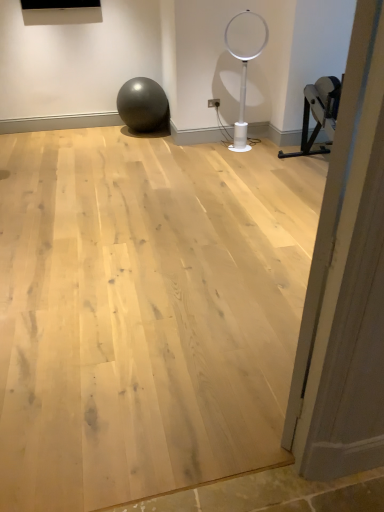
Question: From the image's perspective, is white plastic basketball hoop at center under natural wood floor at center?

Choices:
 (A) yes
 (B) no

Answer: (B)

Question: From the image's perspective, is white plastic basketball hoop at center above natural wood floor at center?

Choices:
 (A) no
 (B) yes

Answer: (B)

Question: Does white plastic basketball hoop at center have a lesser height compared to natural wood floor at center?

Choices:
 (A) yes
 (B) no

Answer: (B)

Question: Is natural wood floor at center surrounded by white plastic basketball hoop at center?

Choices:
 (A) no
 (B) yes

Answer: (A)

Question: Can you confirm if white plastic basketball hoop at center is wider than natural wood floor at center?

Choices:
 (A) yes
 (B) no

Answer: (B)

Question: From a real-world perspective, is white plastic basketball hoop at center above or below natural wood floor at center?

Choices:
 (A) above
 (B) below

Answer: (A)

Question: Is white plastic basketball hoop at center inside or outside of natural wood floor at center?

Choices:
 (A) outside
 (B) inside

Answer: (A)

Question: Is white plastic basketball hoop at center to the left or to the right of natural wood floor at center in the image?

Choices:
 (A) right
 (B) left

Answer: (A)

Question: In the image, is white plastic basketball hoop at center positioned in front of or behind natural wood floor at center?

Choices:
 (A) front
 (B) behind

Answer: (B)

Question: Is natural wood floor at center spatially inside white plastic basketball hoop at center, or outside of it?

Choices:
 (A) outside
 (B) inside

Answer: (A)

Question: Visually, is natural wood floor at center positioned to the left or to the right of white plastic basketball hoop at center?

Choices:
 (A) right
 (B) left

Answer: (B)

Question: From the image's perspective, relative to white plastic basketball hoop at center, is natural wood floor at center above or below?

Choices:
 (A) above
 (B) below

Answer: (B)

Question: Considering the positions of natural wood floor at center and white plastic basketball hoop at center in the image, is natural wood floor at center wider or thinner than white plastic basketball hoop at center?

Choices:
 (A) wide
 (B) thin

Answer: (A)

Question: In terms of height, does matte gray ball at center look taller or shorter compared to white plastic basketball hoop at center?

Choices:
 (A) short
 (B) tall

Answer: (A)

Question: In the image, is matte gray ball at center on the left side or the right side of white plastic basketball hoop at center?

Choices:
 (A) right
 (B) left

Answer: (B)